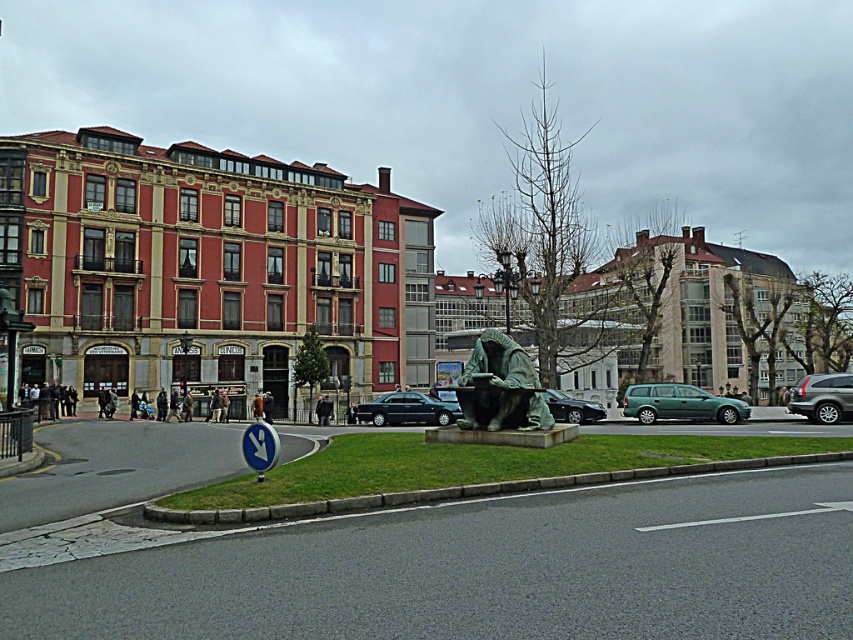
You are an urban planner assessing the space between the green stone statue at center and the green patina statue at center. Which statue has a greater width?

The green stone statue at center has a greater width than the green patina statue at center according to the description.

You are a delivery person who needs to park your vehicle in the parking lot near the red building. You have a green metallic car at center and a green matte van at center. Which vehicle is closer to the right side of the parking lot?

The green matte van at center is closer to the right side of the parking lot because it is positioned to the right of the green metallic car at center.

You are an art student visiting the city and want to sketch the statues in the scene. You have two statues labeled as green stone statue at center and green patina statue at center. Which one should you choose if you want to draw the bigger one?

The green stone statue at center is larger in size than the green patina statue at center, so you should choose the green stone statue at center to draw the bigger one.